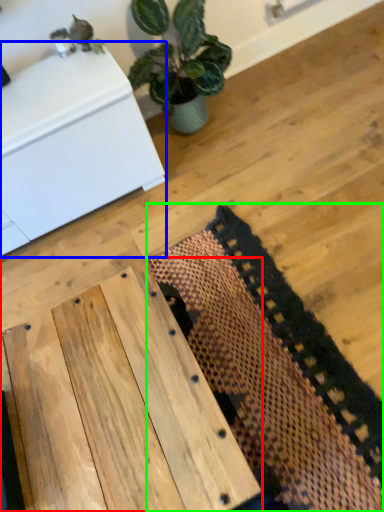
Question: Estimate the real-world distances between objects in this image. Which object is farther from table (highlighted by a red box), furniture (highlighted by a blue box) or mat (highlighted by a green box)?

Choices:
 (A) furniture
 (B) mat

Answer: (A)